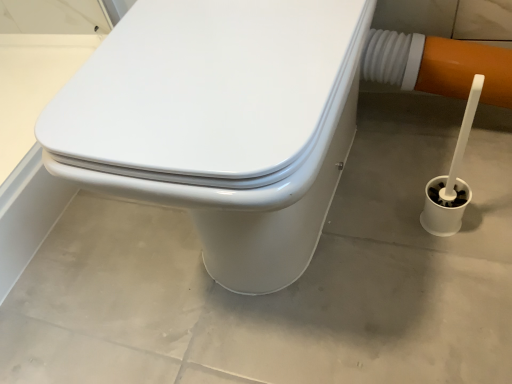
In order to click on white glossy toilet at center in this screenshot , I will do `click(220, 123)`.

Based on the photo, measure the distance between point (295, 213) and camera.

A distance of 28.46 inches exists between point (295, 213) and camera.

Describe the element at coordinates (220, 123) in the screenshot. I see `white glossy toilet at center` at that location.

At what (x,y) coordinates should I click in order to perform the action: click on white glossy toilet at center. Please return your answer as a coordinate pair (x, y). The image size is (512, 384). Looking at the image, I should click on (220, 123).